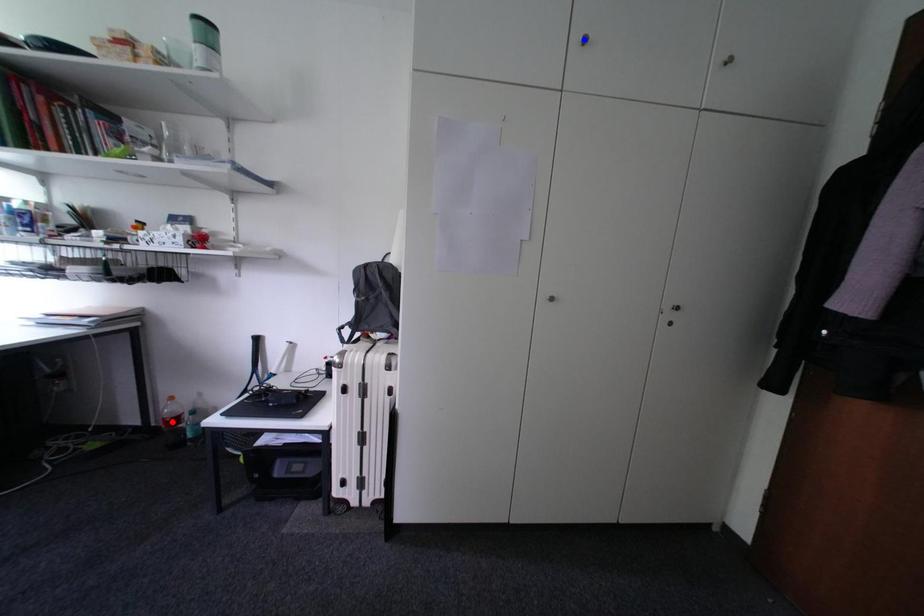
Question: Two points are marked on the image. Which point is closer to the camera?

Choices:
 (A) Blue point is closer.
 (B) Red point is closer.

Answer: (A)